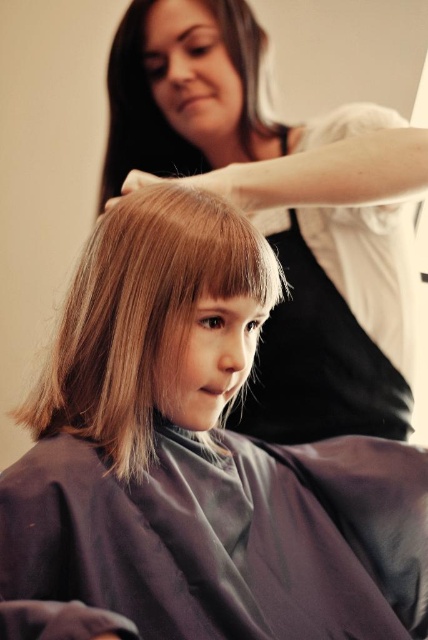
Question: Which object is farther from the camera taking this photo?

Choices:
 (A) blonde hair at center
 (B) black fabric apron at upper center
 (C) blonde smooth hair at center
 (D) matte white shirt at upper center

Answer: (B)

Question: Is matte white shirt at upper center to the left of black fabric apron at upper center from the viewer's perspective?

Choices:
 (A) no
 (B) yes

Answer: (B)

Question: Which object is positioned farthest from the black fabric apron at upper center?

Choices:
 (A) blonde hair at center
 (B) matte white shirt at upper center
 (C) blonde smooth hair at center

Answer: (C)

Question: Does blonde hair at center have a smaller size compared to black fabric apron at upper center?

Choices:
 (A) yes
 (B) no

Answer: (B)

Question: Which point is closer to the camera?

Choices:
 (A) blonde hair at center
 (B) matte white shirt at upper center
 (C) blonde smooth hair at center

Answer: (A)

Question: Is matte white shirt at upper center wider than blonde smooth hair at center?

Choices:
 (A) no
 (B) yes

Answer: (B)